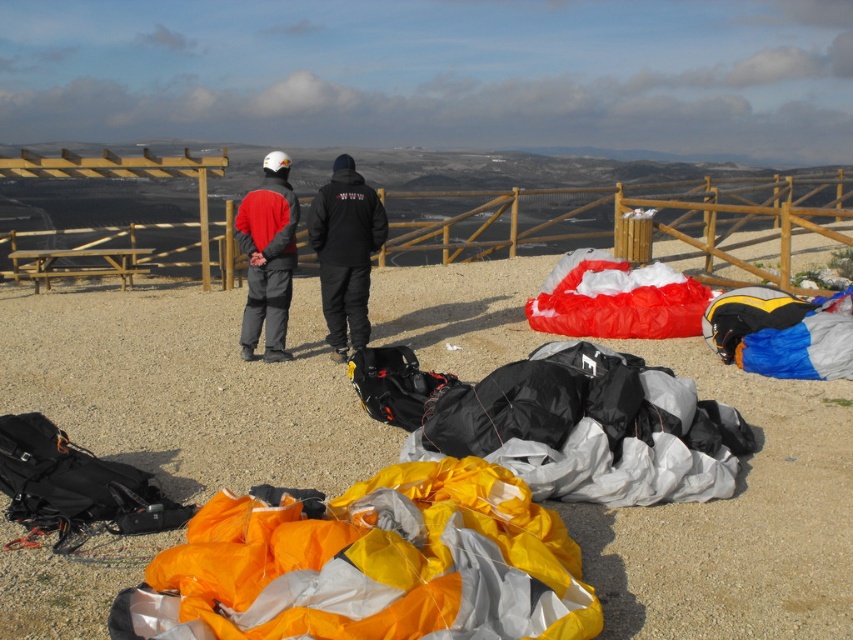
Which is more to the right, orange fabric parachute at center or orange fabric parachute at lower center?

From the viewer's perspective, orange fabric parachute at lower center appears more on the right side.

Does orange fabric parachute at center appear on the right side of orange fabric parachute at lower center?

No, orange fabric parachute at center is not to the right of orange fabric parachute at lower center.

This screenshot has width=853, height=640. I want to click on orange fabric parachute at center, so click(x=187, y=387).

Does orange fabric parachute at center have a lesser width compared to black fabric parachute at center?

In fact, orange fabric parachute at center might be wider than black fabric parachute at center.

Who is higher up, orange fabric parachute at center or black fabric parachute at center?

orange fabric parachute at center is higher up.

Who is more forward, (24, 625) or (628, 444)?

Point (24, 625) is more forward.

Locate an element on the screen. orange fabric parachute at center is located at coordinates (187, 387).

Is black fabric parachute at center thinner than black matte jacket at center?

No.

Does point (585, 442) come farther from viewer compared to point (373, 230)?

No, it is in front of (373, 230).

Who is more forward, (x=506, y=426) or (x=376, y=220)?

Point (x=506, y=426) is more forward.

Image resolution: width=853 pixels, height=640 pixels. What are the coordinates of `black fabric parachute at center` in the screenshot? It's located at (590, 428).